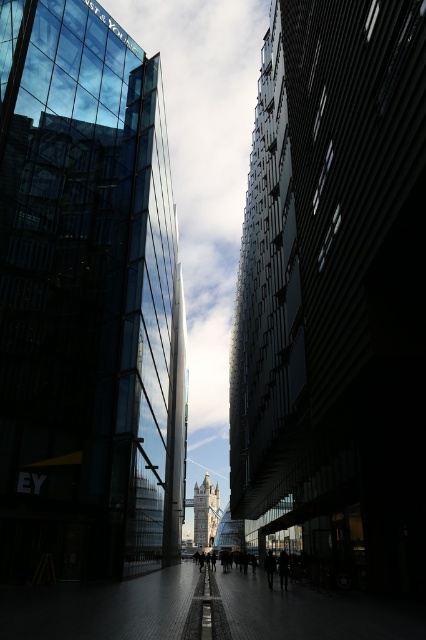
Does dark glass skyscraper at center appear on the left side of dark clothing at center?

In fact, dark glass skyscraper at center is to the right of dark clothing at center.

Can you confirm if dark glass skyscraper at center is smaller than dark clothing at center?

Incorrect, dark glass skyscraper at center is not smaller in size than dark clothing at center.

Locate an element on the screen. Image resolution: width=426 pixels, height=640 pixels. dark glass skyscraper at center is located at coordinates (336, 291).

Which is below, silhouette figure at center or dark clothing at center?

dark clothing at center is below.

Does point (282, 582) come behind point (270, 582)?

Yes, point (282, 582) is behind point (270, 582).

What are the coordinates of `silhouette figure at center` in the screenshot? It's located at (282, 568).

Identify the location of silhouette figure at center. The image size is (426, 640). (282, 568).

Does dark glass skyscraper at center have a greater height compared to silhouette figure at center?

Yes.

Who is taller, dark glass skyscraper at center or silhouette figure at center?

With more height is dark glass skyscraper at center.

Measure the distance between point (284,312) and camera.

The distance of point (284,312) from camera is 79.49 meters.

Identify the location of dark glass skyscraper at center. The height and width of the screenshot is (640, 426). (336, 291).